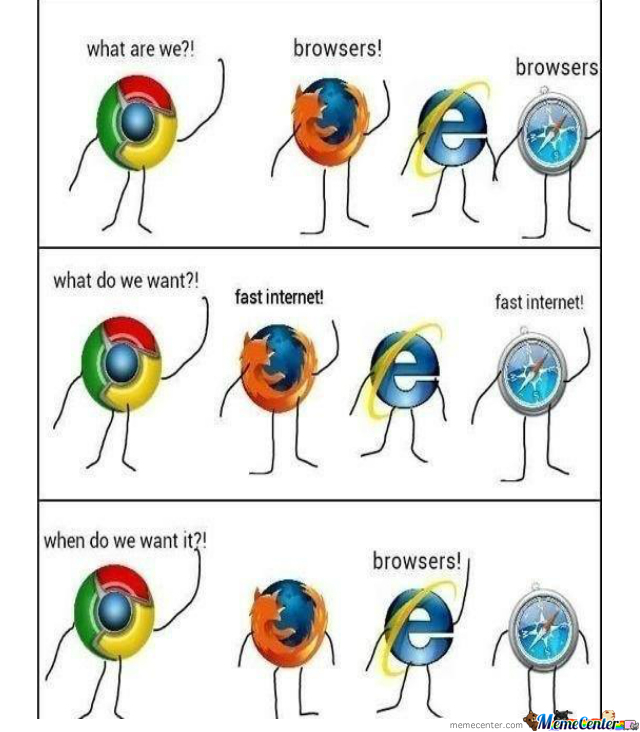
I want to click on panel dividers, so click(x=377, y=244), click(x=356, y=504).